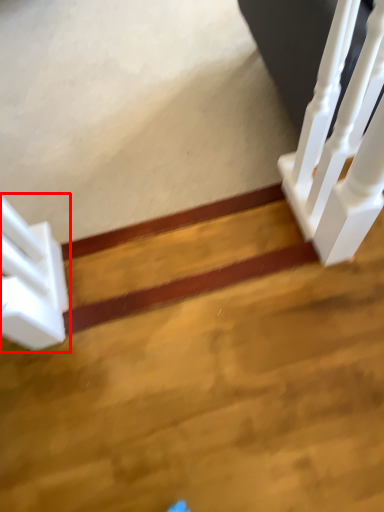
Question: From the image, what is the correct spatial relationship of stairs (annotated by the red box) in relation to stairwell?

Choices:
 (A) left
 (B) right

Answer: (A)